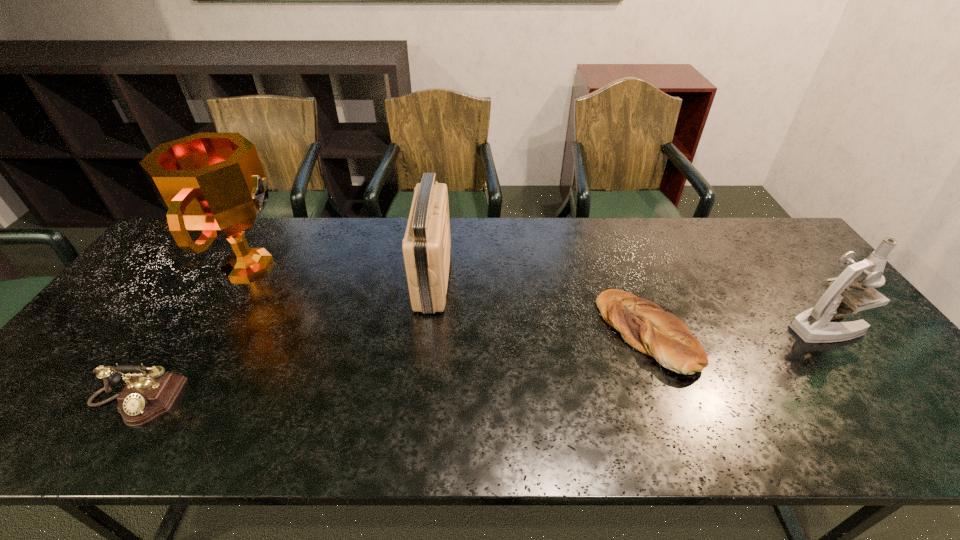
Locate an element on the screen. vacant space that satisfies the following two spatial constraints: 1. on the side of the award with the star emblem; 2. on the dial of the fourth tallest object is located at coordinates (169, 401).

Identify the location of vacant space that satisfies the following two spatial constraints: 1. on the front-facing side of the bread; 2. on the right side of the third object from right to left. (426, 334).

Where is `free space that satisfies the following two spatial constraints: 1. on the front-facing side of the radio receiver; 2. on the back side of the microscope`? The image size is (960, 540). free space that satisfies the following two spatial constraints: 1. on the front-facing side of the radio receiver; 2. on the back side of the microscope is located at coordinates (427, 327).

This screenshot has height=540, width=960. Identify the location of free location that satisfies the following two spatial constraints: 1. on the side of the award with the star emblem; 2. on the left side of the rightmost object. (213, 327).

Where is `free space that satisfies the following two spatial constraints: 1. on the front-facing side of the third object from left to right; 2. on the left side of the shortest object`? The width and height of the screenshot is (960, 540). free space that satisfies the following two spatial constraints: 1. on the front-facing side of the third object from left to right; 2. on the left side of the shortest object is located at coordinates (426, 334).

Image resolution: width=960 pixels, height=540 pixels. I want to click on vacant space that satisfies the following two spatial constraints: 1. on the front-facing side of the third object from right to left; 2. on the back side of the bread, so click(426, 334).

Find the location of a particular element. This screenshot has height=540, width=960. vacant space that satisfies the following two spatial constraints: 1. on the front-facing side of the radio receiver; 2. on the back side of the fourth object from left to right is located at coordinates (426, 334).

Find the location of a particular element. free location that satisfies the following two spatial constraints: 1. on the back side of the bread; 2. on the side of the tallest object with the star emblem is located at coordinates (621, 265).

The image size is (960, 540). Identify the location of vacant area in the image that satisfies the following two spatial constraints: 1. on the front-facing side of the radio receiver; 2. on the dial of the telephone. (419, 401).

At what (x,y) coordinates should I click in order to perform the action: click on vacant space that satisfies the following two spatial constraints: 1. on the front-facing side of the radio receiver; 2. on the left side of the shortest object. Please return your answer as a coordinate pair (x, y). This screenshot has width=960, height=540. Looking at the image, I should click on (426, 334).